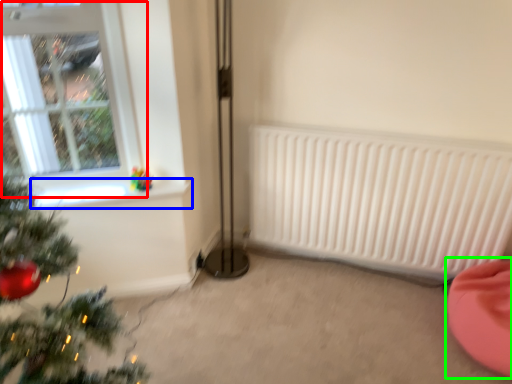
Question: Estimate the real-world distances between objects in this image. Which object is closer to window (highlighted by a red box), window sill (highlighted by a blue box) or bean bag chair (highlighted by a green box)?

Choices:
 (A) window sill
 (B) bean bag chair

Answer: (A)